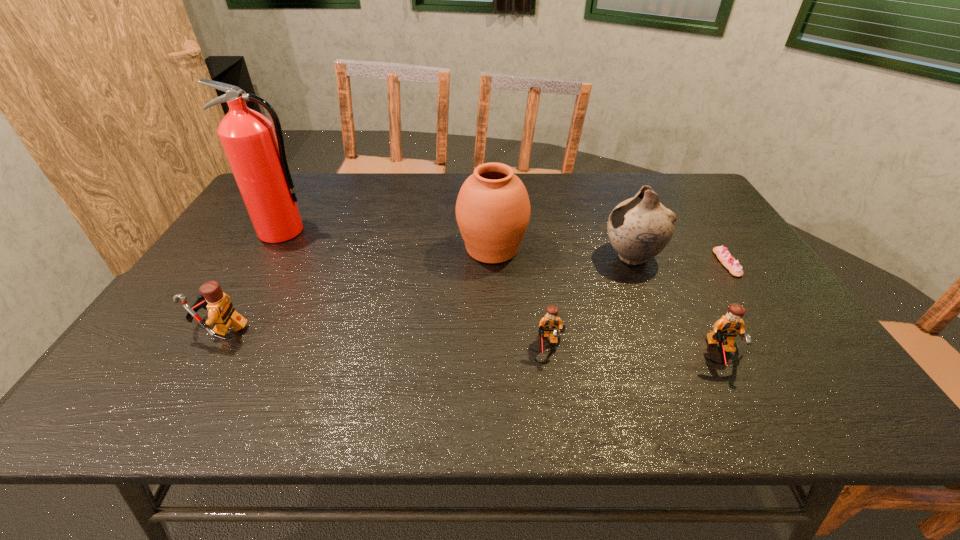
Where is `the tallest Lego`? This screenshot has width=960, height=540. the tallest Lego is located at coordinates (221, 312).

Find the location of a particular element. the leftmost Lego is located at coordinates (221, 312).

At what (x,y) coordinates should I click in order to perform the action: click on the second shortest object. Please return your answer as a coordinate pair (x, y). This screenshot has width=960, height=540. Looking at the image, I should click on (549, 323).

Image resolution: width=960 pixels, height=540 pixels. Identify the location of the shortest Lego. pyautogui.click(x=549, y=323).

In order to click on the second shortest Lego in this screenshot , I will do (x=725, y=329).

At what (x,y) coordinates should I click in order to perform the action: click on the rightmost Lego. Please return your answer as a coordinate pair (x, y). Image resolution: width=960 pixels, height=540 pixels. Looking at the image, I should click on click(x=725, y=329).

Locate an element on the screen. The height and width of the screenshot is (540, 960). fire extinguisher is located at coordinates [x=257, y=157].

You are a GUI agent. You are given a task and a screenshot of the screen. Output one action in this format:
    pyautogui.click(x=<x>, y=<y>)
    Task: Click on the pottery
    The image size is (960, 540).
    Given the screenshot: What is the action you would take?
    pyautogui.click(x=639, y=228)

What are the coordinates of `urn` in the screenshot? It's located at (493, 210).

Locate an element on the screen. The height and width of the screenshot is (540, 960). eclair is located at coordinates [722, 253].